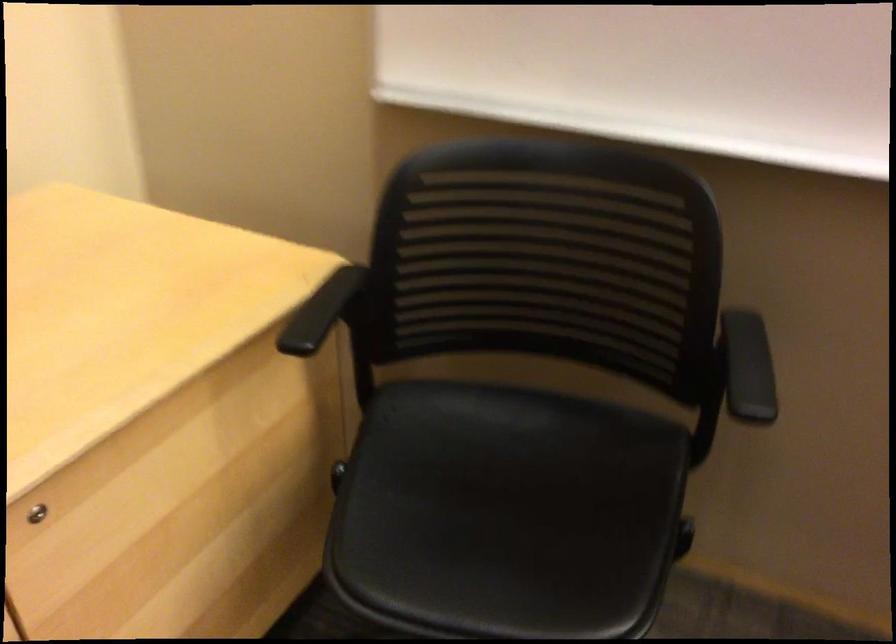
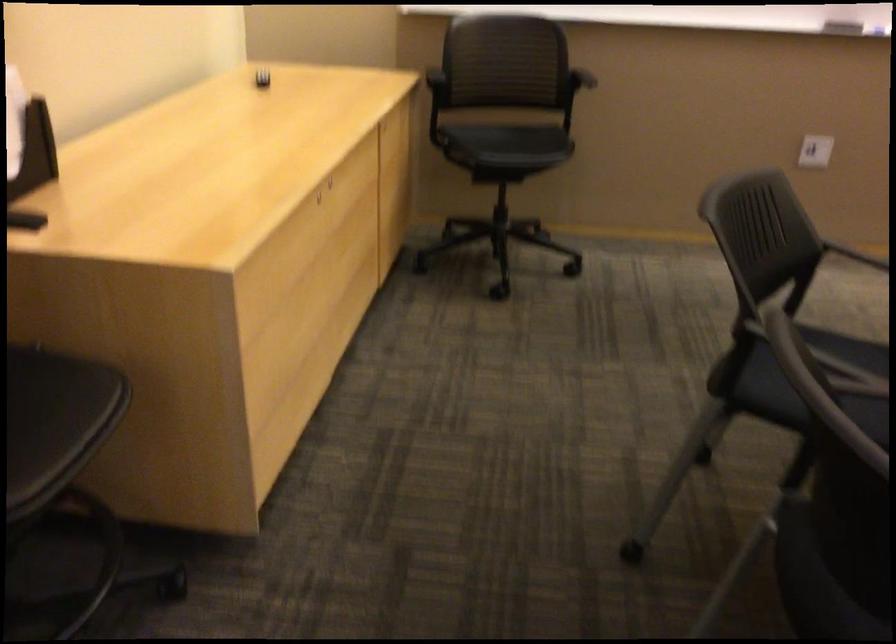
Which direction would the cameraman need to move to produce the second image?

The cameraman moved toward left, backward.